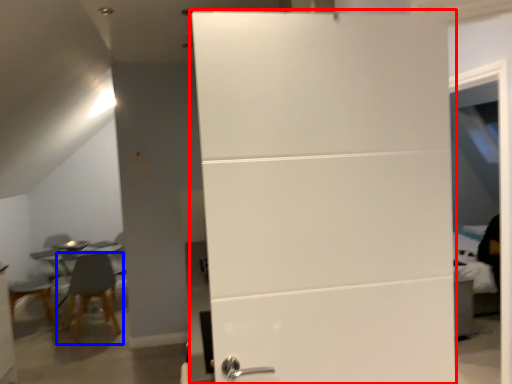
Question: Which object is further to the camera taking this photo, door (highlighted by a red box) or chair (highlighted by a blue box)?

Choices:
 (A) door
 (B) chair

Answer: (B)